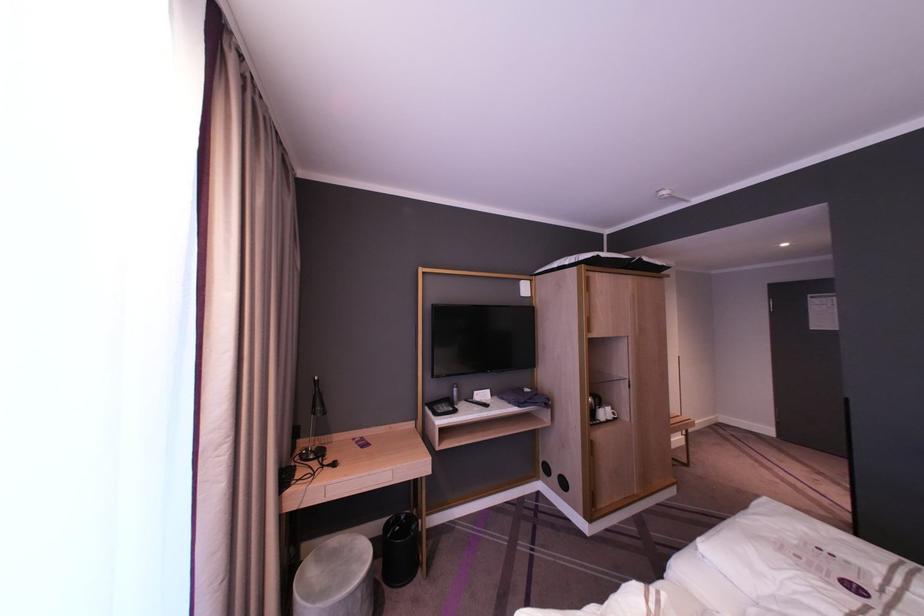
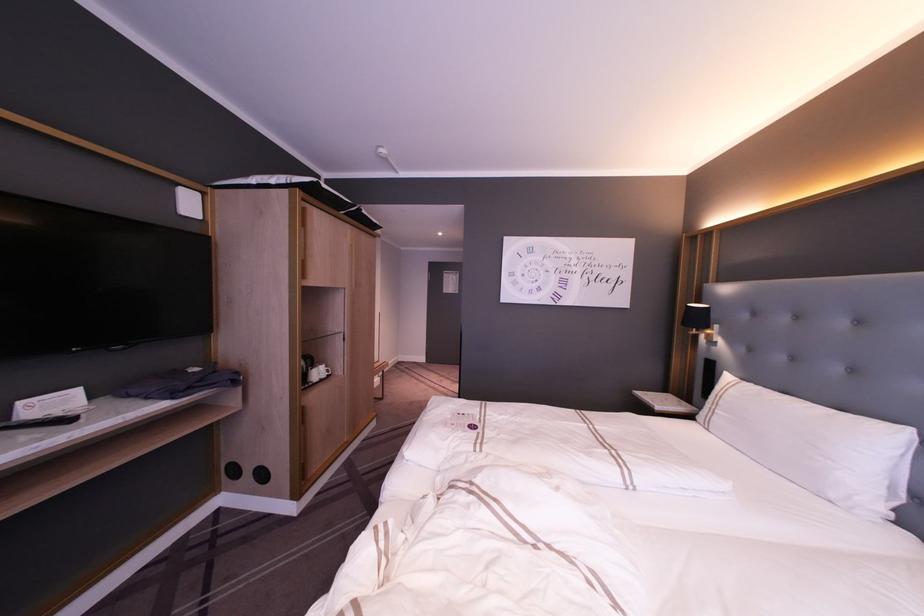
Find the pixel in the second image that matches (x=482, y=403) in the first image.

(59, 419)